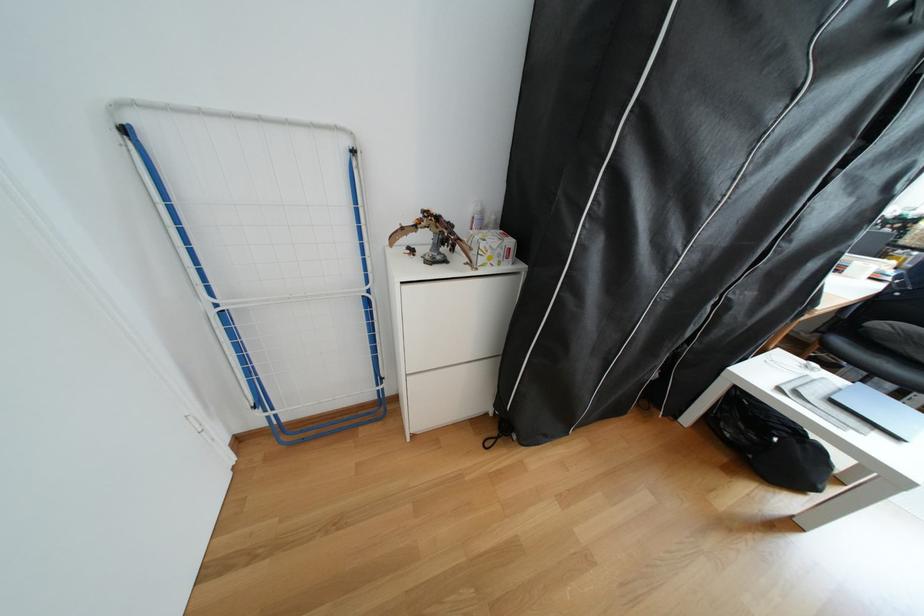
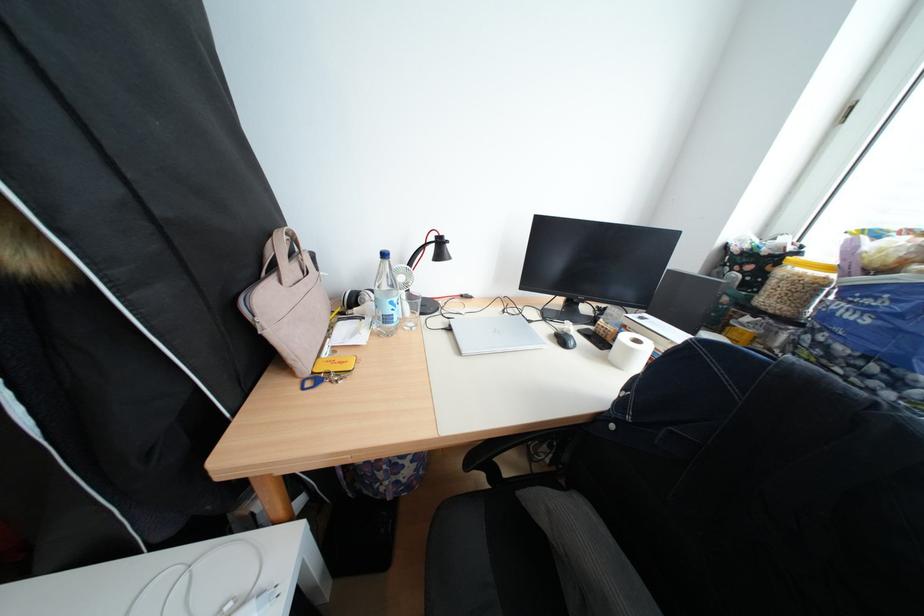
The images are taken continuously from a first-person perspective. In which direction are you moving?

The cameraman moved toward right, forward.